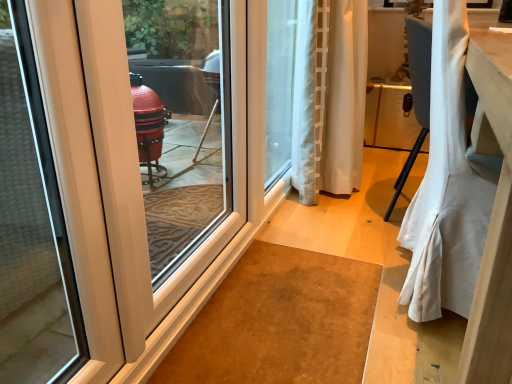
Image resolution: width=512 pixels, height=384 pixels. Find the location of `white sheer curtain at center, marked as the first curtain in a back-to-front arrangement`. white sheer curtain at center, marked as the first curtain in a back-to-front arrangement is located at coordinates (330, 100).

The height and width of the screenshot is (384, 512). In order to click on carpet at center in this screenshot , I will do `click(319, 301)`.

I want to click on white sheer curtain at center, marked as the first curtain in a back-to-front arrangement, so click(330, 100).

From a real-world perspective, does carpet at center stand above white sheer curtain at center, marked as the first curtain in a back-to-front arrangement?

Actually, carpet at center is physically below white sheer curtain at center, marked as the first curtain in a back-to-front arrangement, in the real world.

Is carpet at center bigger or smaller than white sheer curtain at center, marked as the first curtain in a back-to-front arrangement?

Clearly, carpet at center is smaller in size than white sheer curtain at center, marked as the first curtain in a back-to-front arrangement.

Considering the sizes of objects carpet at center and white sheer curtain at center, which is counted as the 2th curtain, starting from the front, in the image provided, who is wider, carpet at center or white sheer curtain at center, which is counted as the 2th curtain, starting from the front,?

carpet at center.

Is carpet at center not close to white sheer curtain at center, which is counted as the 2th curtain, starting from the front?

They are positioned close to each other.

How many degrees apart are the facing directions of white glossy door at left and carpet at center?

There is a 0.474-degree angle between the facing directions of white glossy door at left and carpet at center.

From a real-world perspective, is white glossy door at left above or below carpet at center?

From a real-world perspective, white glossy door at left is physically above carpet at center.

Considering the sizes of objects white glossy door at left and carpet at center in the image provided, who is thinner, white glossy door at left or carpet at center?

With smaller width is white glossy door at left.

From the picture: Which is more to the left, white glossy door at left or carpet at center?

From the viewer's perspective, white glossy door at left appears more on the left side.

Is white sheer curtain at center, marked as the first curtain in a back-to-front arrangement, positioned with its back to white fabric curtain at right, the 2th curtain when ordered from back to front?

white sheer curtain at center, marked as the first curtain in a back-to-front arrangement, is not turned away from white fabric curtain at right, the 2th curtain when ordered from back to front.

Does white sheer curtain at center, marked as the first curtain in a back-to-front arrangement, have a larger size compared to white fabric curtain at right, the 2th curtain when ordered from back to front?

Actually, white sheer curtain at center, marked as the first curtain in a back-to-front arrangement, might be smaller than white fabric curtain at right, the 2th curtain when ordered from back to front.

Would you say white sheer curtain at center, which is counted as the 2th curtain, starting from the front, is outside white fabric curtain at right, the 2th curtain when ordered from back to front?

Absolutely, white sheer curtain at center, which is counted as the 2th curtain, starting from the front, is external to white fabric curtain at right, the 2th curtain when ordered from back to front.

From the image's perspective, relative to white fabric curtain at right, which ranks as the 1th curtain in front-to-back order, is white sheer curtain at center, which is counted as the 2th curtain, starting from the front, above or below?

white sheer curtain at center, which is counted as the 2th curtain, starting from the front, is situated higher than white fabric curtain at right, which ranks as the 1th curtain in front-to-back order, in the image.

Is white sheer curtain at center, marked as the first curtain in a back-to-front arrangement, in front of or behind carpet at center in the image?

Clearly, white sheer curtain at center, marked as the first curtain in a back-to-front arrangement, is behind carpet at center.

From the picture: Is white sheer curtain at center, marked as the first curtain in a back-to-front arrangement, oriented towards carpet at center?

Yes, white sheer curtain at center, marked as the first curtain in a back-to-front arrangement, is oriented towards carpet at center.

Image resolution: width=512 pixels, height=384 pixels. Find the location of `the 2nd curtain behind the carpet at center, counting from the anchor's position`. the 2nd curtain behind the carpet at center, counting from the anchor's position is located at coordinates (330, 100).

Considering the sizes of objects white sheer curtain at center, which is counted as the 2th curtain, starting from the front, and carpet at center in the image provided, who is taller, white sheer curtain at center, which is counted as the 2th curtain, starting from the front, or carpet at center?

white sheer curtain at center, which is counted as the 2th curtain, starting from the front, is taller.

Does white fabric curtain at right, which ranks as the 1th curtain in front-to-back order, have a greater height compared to carpet at center?

Correct, white fabric curtain at right, which ranks as the 1th curtain in front-to-back order, is much taller as carpet at center.

From the image's perspective, would you say white fabric curtain at right, the 2th curtain when ordered from back to front, is shown under carpet at center?

Actually, white fabric curtain at right, the 2th curtain when ordered from back to front, appears above carpet at center in the image.

What's the angular difference between white fabric curtain at right, which ranks as the 1th curtain in front-to-back order, and carpet at center's facing directions?

2.3 degrees separate the facing orientations of white fabric curtain at right, which ranks as the 1th curtain in front-to-back order, and carpet at center.

Considering the points (436, 303) and (280, 316), which point is behind, point (436, 303) or point (280, 316)?

The point (280, 316) is more distant.

Which object is closer to the camera, white sheer curtain at center, marked as the first curtain in a back-to-front arrangement, or white glossy door at left?

white glossy door at left.

At what (x,y) coordinates should I click in order to perform the action: click on door lying in front of the white sheer curtain at center, marked as the first curtain in a back-to-front arrangement. Please return your answer as a coordinate pair (x, y). The height and width of the screenshot is (384, 512). Looking at the image, I should click on (166, 144).

Is white sheer curtain at center, which is counted as the 2th curtain, starting from the front, bigger or smaller than white glossy door at left?

In the image, white sheer curtain at center, which is counted as the 2th curtain, starting from the front, appears to be larger than white glossy door at left.

Is carpet at center shorter than white fabric curtain at right, the 2th curtain when ordered from back to front?

Yes.

Which is more to the left, carpet at center or white fabric curtain at right, which ranks as the 1th curtain in front-to-back order?

Positioned to the left is carpet at center.

From a real-world perspective, between carpet at center and white fabric curtain at right, the 2th curtain when ordered from back to front, who is vertically lower?

carpet at center.

Looking at this image, is carpet at center next to white fabric curtain at right, the 2th curtain when ordered from back to front, and touching it?

There is a gap between carpet at center and white fabric curtain at right, the 2th curtain when ordered from back to front.

Image resolution: width=512 pixels, height=384 pixels. Find the location of `path in front of the white sheer curtain at center, which is counted as the 2th curtain, starting from the front`. path in front of the white sheer curtain at center, which is counted as the 2th curtain, starting from the front is located at coordinates (319, 301).

At what (x,y) coordinates should I click in order to perform the action: click on path below the white glossy door at left (from a real-world perspective). Please return your answer as a coordinate pair (x, y). Looking at the image, I should click on (319, 301).

Based on their spatial positions, is white sheer curtain at center, marked as the first curtain in a back-to-front arrangement, or white glossy door at left further from carpet at center?

white glossy door at left is further to carpet at center.

From the picture: Considering their positions, is white glossy door at left positioned closer to white fabric curtain at right, the 2th curtain when ordered from back to front, than carpet at center?

The object closer to white fabric curtain at right, the 2th curtain when ordered from back to front, is carpet at center.

Considering their positions, is white glossy door at left positioned closer to white sheer curtain at center, marked as the first curtain in a back-to-front arrangement, than carpet at center?

carpet at center is positioned closer to the anchor white sheer curtain at center, marked as the first curtain in a back-to-front arrangement.

Looking at the image, which one is located closer to white sheer curtain at center, which is counted as the 2th curtain, starting from the front, carpet at center or white fabric curtain at right, which ranks as the 1th curtain in front-to-back order?

carpet at center is closer to white sheer curtain at center, which is counted as the 2th curtain, starting from the front.

Considering their positions, is white glossy door at left positioned closer to carpet at center than white sheer curtain at center, marked as the first curtain in a back-to-front arrangement?

white sheer curtain at center, marked as the first curtain in a back-to-front arrangement, lies closer to carpet at center than the other object.

Considering their positions, is white sheer curtain at center, marked as the first curtain in a back-to-front arrangement, positioned closer to white fabric curtain at right, the 2th curtain when ordered from back to front, than carpet at center?

Based on the image, carpet at center appears to be nearer to white fabric curtain at right, the 2th curtain when ordered from back to front.

Looking at the image, which one is located further to white sheer curtain at center, which is counted as the 2th curtain, starting from the front, carpet at center or white glossy door at left?

The object further to white sheer curtain at center, which is counted as the 2th curtain, starting from the front, is white glossy door at left.

Based on their spatial positions, is white sheer curtain at center, marked as the first curtain in a back-to-front arrangement, or white fabric curtain at right, the 2th curtain when ordered from back to front, closer to white glossy door at left?

white sheer curtain at center, marked as the first curtain in a back-to-front arrangement, lies closer to white glossy door at left than the other object.

This screenshot has height=384, width=512. I want to click on path located between white glossy door at left and white fabric curtain at right, the 2th curtain when ordered from back to front, in the left-right direction, so click(x=319, y=301).

What are the coordinates of `curtain between white glossy door at left and white sheer curtain at center, which is counted as the 2th curtain, starting from the front, from front to back` in the screenshot? It's located at (447, 187).

Locate an element on the screen. This screenshot has width=512, height=384. path located between white glossy door at left and white sheer curtain at center, marked as the first curtain in a back-to-front arrangement, in the depth direction is located at coordinates (319, 301).

Where is `curtain located between carpet at center and white sheer curtain at center, marked as the first curtain in a back-to-front arrangement, in the depth direction`? This screenshot has height=384, width=512. curtain located between carpet at center and white sheer curtain at center, marked as the first curtain in a back-to-front arrangement, in the depth direction is located at coordinates (447, 187).